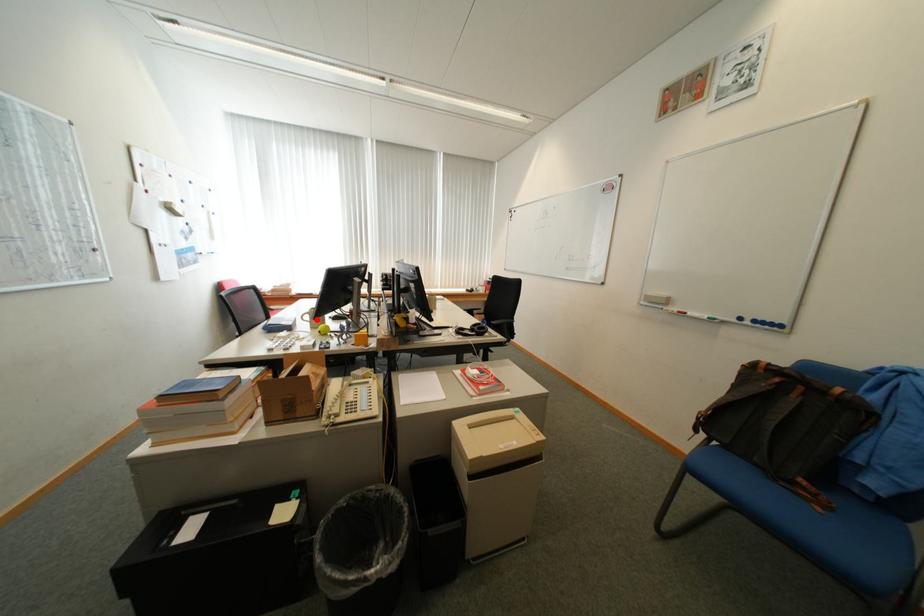
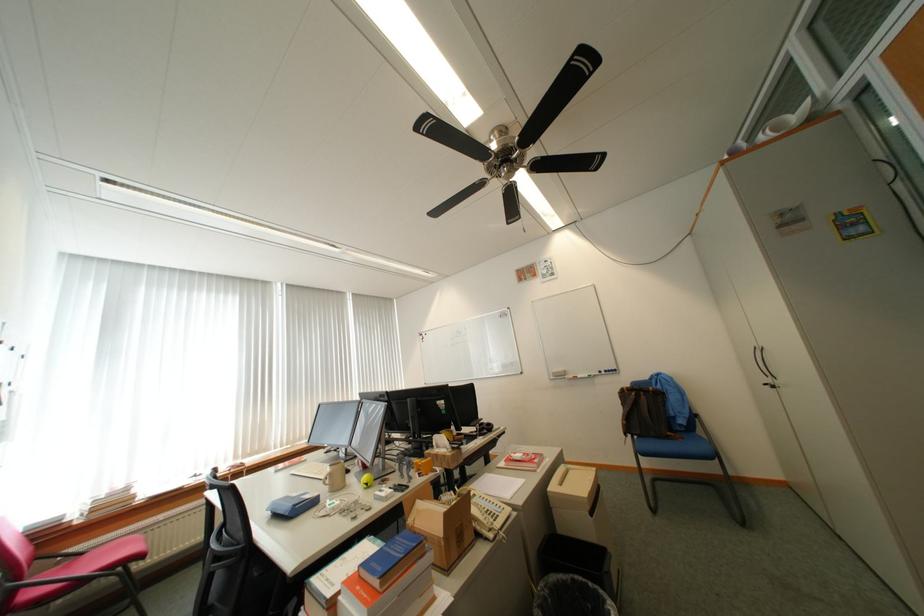
Find the pixel in the second image that matches the highlighted location in the first image.

(336, 482)